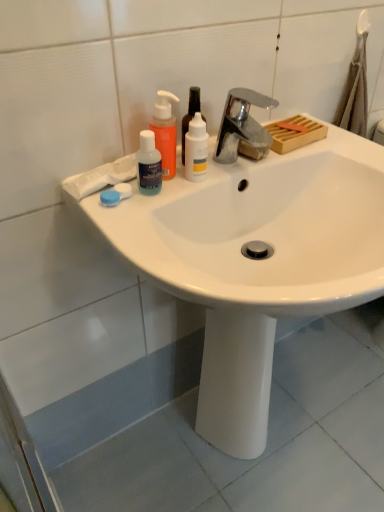
Identify the location of vacant space in front of blue plastic contact lens case at left. This screenshot has height=512, width=384. (139, 241).